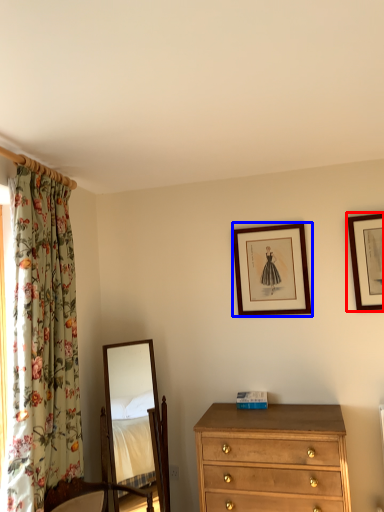
Question: Among these objects, which one is farthest to the camera, picture frame (highlighted by a red box) or picture frame (highlighted by a blue box)?

Choices:
 (A) picture frame
 (B) picture frame

Answer: (B)